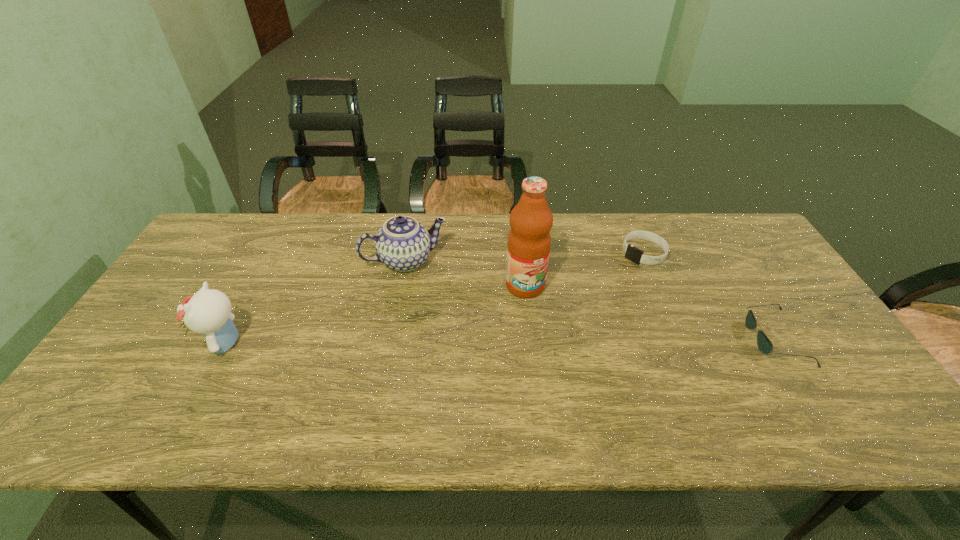
Locate an element on the screen. Image resolution: width=960 pixels, height=540 pixels. kitten is located at coordinates (208, 312).

Locate an element on the screen. Image resolution: width=960 pixels, height=540 pixels. the rightmost object is located at coordinates (765, 346).

Locate an element on the screen. The image size is (960, 540). the second object from right to left is located at coordinates (632, 253).

Find the location of a particular element. the fourth object from right to left is located at coordinates [403, 244].

Find the location of a particular element. the third object from left to right is located at coordinates (529, 241).

Identify the location of fruit juice. coord(529,241).

This screenshot has width=960, height=540. I want to click on free location located 0.170m on the front-facing side of the leftmost object, so click(x=140, y=342).

This screenshot has width=960, height=540. In order to click on free space located on the front-facing side of the leftmost object in this screenshot , I will do `click(163, 342)`.

Identify the location of free location located 0.200m on the front-facing side of the leftmost object. (129, 342).

Locate an element on the screen. The height and width of the screenshot is (540, 960). vacant space located on the lenses of the sunglasses is located at coordinates (600, 338).